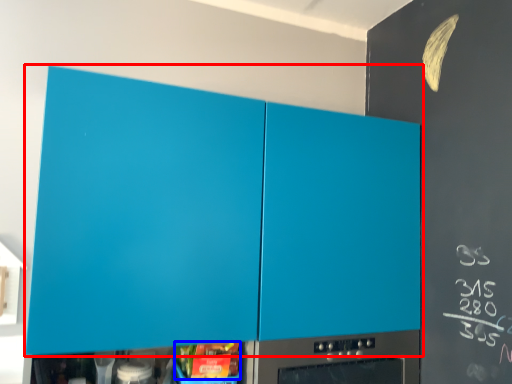
Question: Which object appears closest to the camera in this image, cabinetry (highlighted by a red box) or food (highlighted by a blue box)?

Choices:
 (A) cabinetry
 (B) food

Answer: (A)